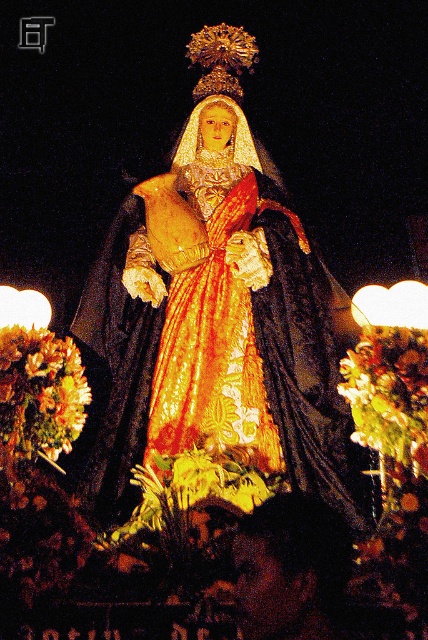
Question: Which point is farther to the camera?

Choices:
 (A) (279, 449)
 (B) (80, 403)
 (C) (258, 392)

Answer: (C)

Question: Does gold sequined dress at center have a greater width compared to shiny gold dress at center?

Choices:
 (A) yes
 (B) no

Answer: (A)

Question: Which point is closer to the camera?

Choices:
 (A) pyautogui.click(x=71, y=445)
 (B) pyautogui.click(x=219, y=385)

Answer: (A)

Question: Can you confirm if gold sequined dress at center is positioned above shiny dark hair at lower center?

Choices:
 (A) yes
 (B) no

Answer: (A)

Question: Where is shiny gold dress at center located in relation to shiny dark hair at lower center in the image?

Choices:
 (A) left
 (B) right

Answer: (A)

Question: Which object is positioned farthest from the golden textured wreath at lower left?

Choices:
 (A) shiny gold dress at center
 (B) shiny dark hair at lower center

Answer: (B)